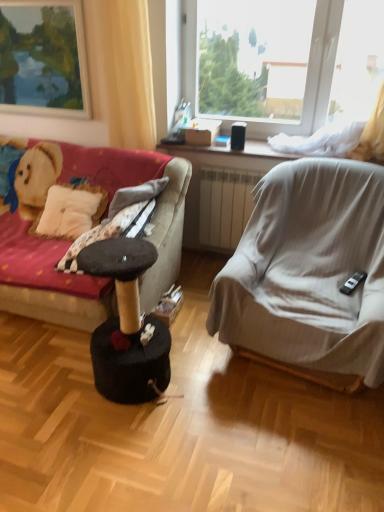
Locate an element on the screen. vacant space in front of black felt cat tree at center is located at coordinates (116, 439).